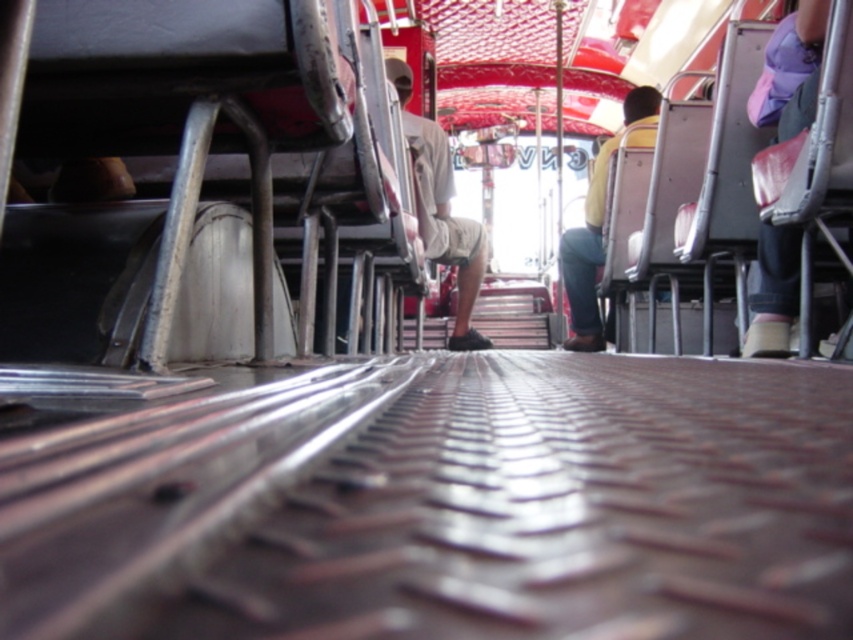
Is khaki shorts at center smaller than purple fabric cap at upper right?

Actually, khaki shorts at center might be larger than purple fabric cap at upper right.

Is point (466, 221) behind point (802, 96)?

That is True.

Where is `khaki shorts at center`? khaki shorts at center is located at coordinates (440, 211).

At what (x,y) coordinates should I click in order to perform the action: click on khaki shorts at center. Please return your answer as a coordinate pair (x, y). Looking at the image, I should click on (440, 211).

Can you confirm if purple fabric cap at upper right is taller than yellow fabric shirt at center?

No.

What do you see at coordinates (775, 291) in the screenshot?
I see `purple fabric cap at upper right` at bounding box center [775, 291].

What are the coordinates of `purple fabric cap at upper right` in the screenshot? It's located at (775, 291).

Between khaki shorts at center and yellow fabric shirt at center, which one has less height?

khaki shorts at center is shorter.

Consider the image. Who is higher up, khaki shorts at center or yellow fabric shirt at center?

Positioned higher is yellow fabric shirt at center.

In order to click on khaki shorts at center in this screenshot , I will do pos(440,211).